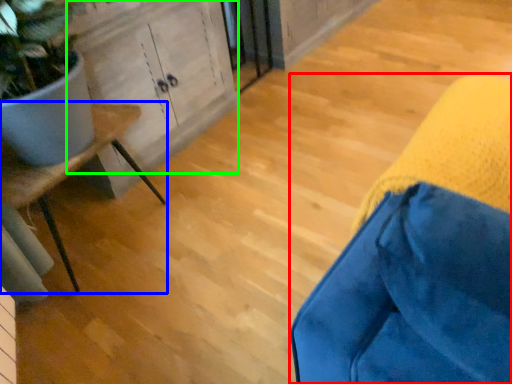
Question: Which object is positioned farthest from furniture (highlighted by a red box)? Select from furniture (highlighted by a blue box) and cabinetry (highlighted by a green box).

Choices:
 (A) furniture
 (B) cabinetry

Answer: (B)